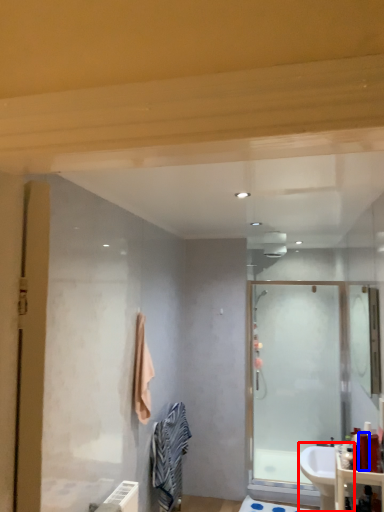
Question: Which point is further to the camera, sink (highlighted by a red box) or toiletry (highlighted by a blue box)?

Choices:
 (A) sink
 (B) toiletry

Answer: (A)